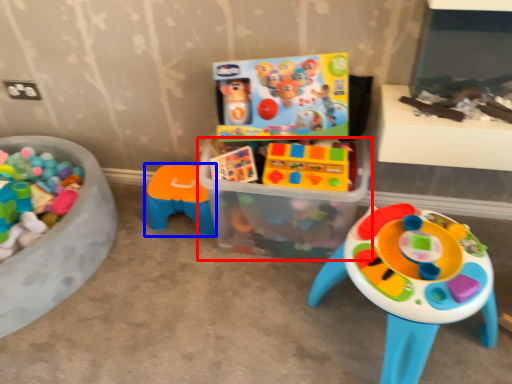
Question: Which object appears farthest to the camera in this image, box (highlighted by a red box) or toy (highlighted by a blue box)?

Choices:
 (A) box
 (B) toy

Answer: (B)